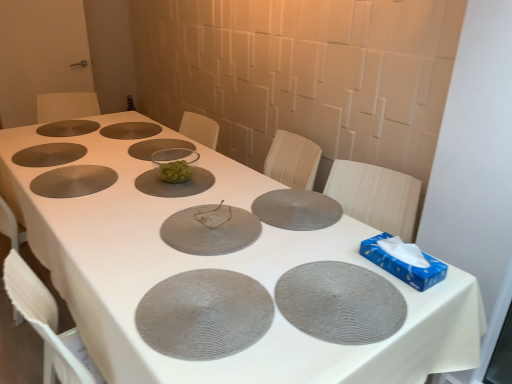
This screenshot has width=512, height=384. I want to click on free spot above matte gray placemat at center (from a real-world perspective), so click(x=147, y=201).